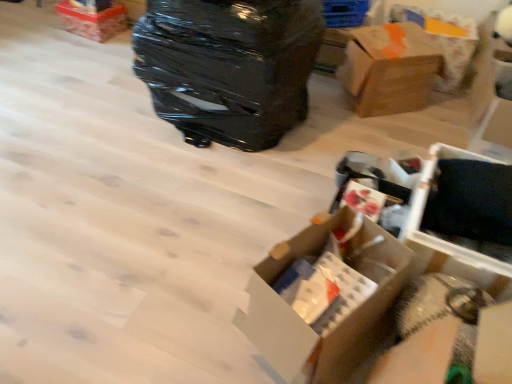
This screenshot has height=384, width=512. What do you see at coordinates (449, 241) in the screenshot?
I see `white plastic storage box at lower right, the first storage box in the front-to-back sequence` at bounding box center [449, 241].

The height and width of the screenshot is (384, 512). What do you see at coordinates (389, 69) in the screenshot? I see `brown cardboard box at upper right, the 1th box when ordered from right to left` at bounding box center [389, 69].

Measure the distance between brown cardboard box at upper right, positioned as the second box in bottom-to-top order, and camera.

brown cardboard box at upper right, positioned as the second box in bottom-to-top order, is 7.34 feet from camera.

This screenshot has height=384, width=512. In order to click on cardboard box at upper right in this screenshot , I will do `click(443, 40)`.

This screenshot has height=384, width=512. In order to click on white plastic storage box at lower right, placed as the 2th storage box when sorted from back to front in this screenshot , I will do `click(449, 241)`.

Is blue plastic storage box at upper center, which is the second storage box in front-to-back order, behind cardboard box at upper right?

Yes, blue plastic storage box at upper center, which is the second storage box in front-to-back order, is further from the viewer.

Could you tell me if blue plastic storage box at upper center, positioned as the 1th storage box in top-to-bottom order, is facing cardboard box at upper right?

No, blue plastic storage box at upper center, positioned as the 1th storage box in top-to-bottom order, is not facing towards cardboard box at upper right.

Looking at this image, is blue plastic storage box at upper center, positioned as the second storage box in bottom-to-top order, inside the boundaries of cardboard box at upper right, or outside?

blue plastic storage box at upper center, positioned as the second storage box in bottom-to-top order, is spatially situated outside cardboard box at upper right.

Does blue plastic storage box at upper center, which is the second storage box in front-to-back order, appear on the right side of cardboard box at upper right?

In fact, blue plastic storage box at upper center, which is the second storage box in front-to-back order, is to the left of cardboard box at upper right.

Considering the sizes of white cardboard box at center, the 1th box in the bottom-to-top sequence, and black plastic suitcase at upper center in the image, is white cardboard box at center, the 1th box in the bottom-to-top sequence, taller or shorter than black plastic suitcase at upper center?

Clearly, white cardboard box at center, the 1th box in the bottom-to-top sequence, is shorter compared to black plastic suitcase at upper center.

From a real-world perspective, is white cardboard box at center, which ranks as the third box in top-to-bottom order, physically located above or below black plastic suitcase at upper center?

white cardboard box at center, which ranks as the third box in top-to-bottom order, is below black plastic suitcase at upper center.

Can black plastic suitcase at upper center be found inside white cardboard box at center, which ranks as the third box in top-to-bottom order?

No, black plastic suitcase at upper center is not inside white cardboard box at center, which ranks as the third box in top-to-bottom order.

Based on the photo, which of these two, white cardboard box at center, the 1th box in the bottom-to-top sequence, or cardboard box at upper right, stands shorter?

Standing shorter between the two is cardboard box at upper right.

Is point (397, 258) farther from camera compared to point (451, 87)?

No, (397, 258) is in front of (451, 87).

In the scene shown: Considering the relative positions of white cardboard box at center, which appears as the 1th box when viewed from the front, and cardboard box at upper right in the image provided, is white cardboard box at center, which appears as the 1th box when viewed from the front, behind cardboard box at upper right?

No, white cardboard box at center, which appears as the 1th box when viewed from the front, is in front of cardboard box at upper right.

How many degrees apart are the facing directions of cardboard box at upper right and matte cardboard box at upper left, marked as the 1th box in a left-to-right arrangement?

13 degrees separate the facing orientations of cardboard box at upper right and matte cardboard box at upper left, marked as the 1th box in a left-to-right arrangement.

Which is further, (x=457, y=46) or (x=72, y=24)?

Point (x=72, y=24)

Considering the relative sizes of cardboard box at upper right and matte cardboard box at upper left, placed as the 1th box when sorted from top to bottom, in the image provided, is cardboard box at upper right taller than matte cardboard box at upper left, placed as the 1th box when sorted from top to bottom,?

Yes.

Between cardboard box at upper right and matte cardboard box at upper left, which is counted as the third box, starting from the right, which one has larger width?

cardboard box at upper right.

Does white plastic storage box at lower right, the first storage box in the front-to-back sequence, lie behind white cardboard box at center, the second box positioned from the left?

Yes.

Identify the location of box below the white plastic storage box at lower right, placed as the first storage box when sorted from bottom to top (from the image's perspective). The image size is (512, 384). (325, 298).

From the image's perspective, is white plastic storage box at lower right, which is the second storage box in top-to-bottom order, located above white cardboard box at center, the 2th box positioned from the right?

Yes, from the image's perspective, white plastic storage box at lower right, which is the second storage box in top-to-bottom order, is over white cardboard box at center, the 2th box positioned from the right.

From a real-world perspective, relative to white plastic storage box at lower right, which is the second storage box in top-to-bottom order, is blue plastic storage box at upper center, positioned as the 1th storage box in top-to-bottom order, vertically above or below?

In terms of real-world spatial position, blue plastic storage box at upper center, positioned as the 1th storage box in top-to-bottom order, is above white plastic storage box at lower right, which is the second storage box in top-to-bottom order.

Which object is further away from the camera taking this photo, blue plastic storage box at upper center, positioned as the 1th storage box in top-to-bottom order, or white plastic storage box at lower right, the first storage box in the front-to-back sequence?

blue plastic storage box at upper center, positioned as the 1th storage box in top-to-bottom order, is behind.

Looking at this image, is blue plastic storage box at upper center, positioned as the 1th storage box in top-to-bottom order, inside or outside of white plastic storage box at lower right, the first storage box in the front-to-back sequence?

blue plastic storage box at upper center, positioned as the 1th storage box in top-to-bottom order, is not enclosed by white plastic storage box at lower right, the first storage box in the front-to-back sequence.

The width and height of the screenshot is (512, 384). I want to click on storage box in front of the blue plastic storage box at upper center, which is the second storage box in front-to-back order, so click(x=449, y=241).

Is point (80, 27) positioned before point (343, 3)?

No, it is not.

Which is in front, matte cardboard box at upper left, placed as the 1th box when sorted from top to bottom, or blue plastic storage box at upper center, the 1th storage box positioned from the back?

Positioned in front is blue plastic storage box at upper center, the 1th storage box positioned from the back.

Considering the positions of objects matte cardboard box at upper left, the 3th box in the front-to-back sequence, and blue plastic storage box at upper center, positioned as the second storage box in bottom-to-top order, in the image provided, who is more to the left, matte cardboard box at upper left, the 3th box in the front-to-back sequence, or blue plastic storage box at upper center, positioned as the second storage box in bottom-to-top order,?

matte cardboard box at upper left, the 3th box in the front-to-back sequence, is more to the left.

Could you tell me if matte cardboard box at upper left, which is counted as the 3th box, starting from the bottom, is turned towards blue plastic storage box at upper center, positioned as the 1th storage box in top-to-bottom order?

No, matte cardboard box at upper left, which is counted as the 3th box, starting from the bottom, is not oriented towards blue plastic storage box at upper center, positioned as the 1th storage box in top-to-bottom order.

This screenshot has height=384, width=512. Find the location of `cardboard box below the blue plastic storage box at upper center, positioned as the second storage box in bottom-to-top order (from a real-world perspective)`. cardboard box below the blue plastic storage box at upper center, positioned as the second storage box in bottom-to-top order (from a real-world perspective) is located at coordinates (443, 40).

Which box is the 1st one when counting from the right side of the black plastic suitcase at upper center? Please provide its 2D coordinates.

[(325, 298)]

When comparing their distances from cardboard box at upper right, does brown cardboard box at upper right, the 2th box when ordered from top to bottom, or white plastic storage box at lower right, the first storage box in the front-to-back sequence, seem further?

white plastic storage box at lower right, the first storage box in the front-to-back sequence, is further to cardboard box at upper right.

Consider the image. From the image, which object appears to be nearer to white cardboard box at center, which ranks as the third box in top-to-bottom order, cardboard box at upper right or white plastic storage box at lower right, placed as the 2th storage box when sorted from back to front?

white plastic storage box at lower right, placed as the 2th storage box when sorted from back to front, is positioned closer to the anchor white cardboard box at center, which ranks as the third box in top-to-bottom order.

Considering their positions, is cardboard box at upper right positioned closer to matte cardboard box at upper left, marked as the 1th box in a left-to-right arrangement, than blue plastic storage box at upper center, which is the second storage box in front-to-back order?

Based on the image, blue plastic storage box at upper center, which is the second storage box in front-to-back order, appears to be nearer to matte cardboard box at upper left, marked as the 1th box in a left-to-right arrangement.

Looking at this image, estimate the real-world distances between objects in this image. Which object is further from brown cardboard box at upper right, which is the 2th box in back-to-front order, blue plastic storage box at upper center, positioned as the second storage box in bottom-to-top order, or black plastic suitcase at upper center?

black plastic suitcase at upper center is positioned further to the anchor brown cardboard box at upper right, which is the 2th box in back-to-front order.

From the image, which object appears to be farther from brown cardboard box at upper right, the 1th box when ordered from right to left, matte cardboard box at upper left, marked as the 1th box in a left-to-right arrangement, or white plastic storage box at lower right, placed as the first storage box when sorted from bottom to top?

matte cardboard box at upper left, marked as the 1th box in a left-to-right arrangement, lies further to brown cardboard box at upper right, the 1th box when ordered from right to left, than the other object.

Based on their spatial positions, is matte cardboard box at upper left, the 3th box in the front-to-back sequence, or white cardboard box at center, the second box positioned from the left, further from white plastic storage box at lower right, placed as the 2th storage box when sorted from back to front?

matte cardboard box at upper left, the 3th box in the front-to-back sequence, lies further to white plastic storage box at lower right, placed as the 2th storage box when sorted from back to front, than the other object.

Considering their positions, is white plastic storage box at lower right, placed as the 2th storage box when sorted from back to front, positioned closer to cardboard box at upper right than white cardboard box at center, marked as the third box in a back-to-front arrangement?

white plastic storage box at lower right, placed as the 2th storage box when sorted from back to front, lies closer to cardboard box at upper right than the other object.

Which object lies further to the anchor point blue plastic storage box at upper center, which is the second storage box in front-to-back order, white plastic storage box at lower right, placed as the first storage box when sorted from bottom to top, or cardboard box at upper right?

white plastic storage box at lower right, placed as the first storage box when sorted from bottom to top, is positioned further to the anchor blue plastic storage box at upper center, which is the second storage box in front-to-back order.

Find the location of `storage box situated between black plastic suitcase at upper center and brown cardboard box at upper right, the third box when ordered from left to right, from left to right`. storage box situated between black plastic suitcase at upper center and brown cardboard box at upper right, the third box when ordered from left to right, from left to right is located at coordinates (345, 13).

I want to click on box between white cardboard box at center, which appears as the 1th box when viewed from the front, and cardboard box at upper right from front to back, so click(x=389, y=69).

Locate an element on the screen. This screenshot has height=384, width=512. garbage between blue plastic storage box at upper center, positioned as the second storage box in bottom-to-top order, and white plastic storage box at lower right, placed as the 2th storage box when sorted from back to front, from top to bottom is located at coordinates (229, 67).

The image size is (512, 384). I want to click on garbage between blue plastic storage box at upper center, which is the second storage box in front-to-back order, and white cardboard box at center, the 2th box positioned from the right, in the up-down direction, so click(229, 67).